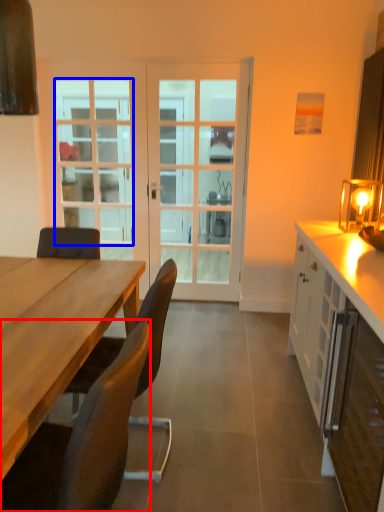
Question: Which of the following is the farthest to the observer, chair (highlighted by a red box) or window (highlighted by a blue box)?

Choices:
 (A) chair
 (B) window

Answer: (B)